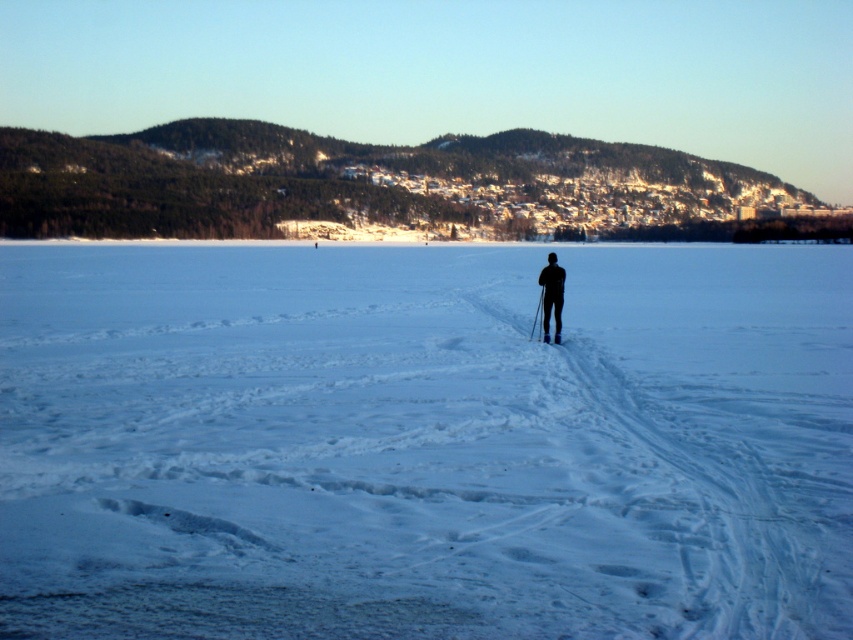
Question: Which point is closer to the camera?

Choices:
 (A) white powder snow at center
 (B) black matte skier at center

Answer: (A)

Question: Where is white powder snow at center located in relation to black matte skier at center in the image?

Choices:
 (A) right
 (B) left

Answer: (A)

Question: Is white powder snow at center below black matte skier at center?

Choices:
 (A) yes
 (B) no

Answer: (B)

Question: Which point is closer to the camera taking this photo?

Choices:
 (A) (30, 291)
 (B) (548, 260)

Answer: (B)

Question: Is white powder snow at center wider than black matte skier at center?

Choices:
 (A) yes
 (B) no

Answer: (A)

Question: Among these objects, which one is nearest to the camera?

Choices:
 (A) white powder snow at center
 (B) black matte skier at center

Answer: (A)